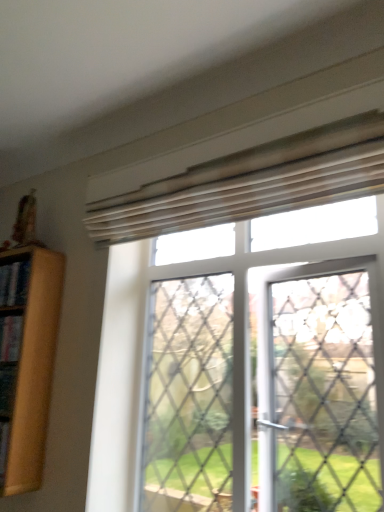
Question: Is wooden bookshelf at left thinner than translucent wood blinds at upper center?

Choices:
 (A) no
 (B) yes

Answer: (B)

Question: Could you tell me if wooden bookshelf at left is facing translucent wood blinds at upper center?

Choices:
 (A) no
 (B) yes

Answer: (A)

Question: Does wooden bookshelf at left appear on the left side of translucent wood blinds at upper center?

Choices:
 (A) no
 (B) yes

Answer: (B)

Question: From a real-world perspective, does wooden bookshelf at left sit lower than translucent wood blinds at upper center?

Choices:
 (A) no
 (B) yes

Answer: (B)

Question: From a real-world perspective, is wooden bookshelf at left over translucent wood blinds at upper center?

Choices:
 (A) no
 (B) yes

Answer: (A)

Question: Is wooden bookshelf at left placed right next to translucent wood blinds at upper center?

Choices:
 (A) yes
 (B) no

Answer: (B)

Question: Would you say translucent wood blinds at upper center contains wooden bookshelf at left?

Choices:
 (A) no
 (B) yes

Answer: (A)

Question: Can you confirm if translucent wood blinds at upper center is wider than wooden bookshelf at left?

Choices:
 (A) no
 (B) yes

Answer: (B)

Question: Is translucent wood blinds at upper center thinner than wooden bookshelf at left?

Choices:
 (A) no
 (B) yes

Answer: (A)

Question: Can you confirm if translucent wood blinds at upper center is positioned to the right of wooden bookshelf at left?

Choices:
 (A) yes
 (B) no

Answer: (A)

Question: Is translucent wood blinds at upper center at the left side of wooden bookshelf at left?

Choices:
 (A) no
 (B) yes

Answer: (A)

Question: Considering the relative positions of translucent wood blinds at upper center and wooden bookshelf at left in the image provided, is translucent wood blinds at upper center in front of wooden bookshelf at left?

Choices:
 (A) no
 (B) yes

Answer: (B)

Question: In terms of height, does wooden bookshelf at left look taller or shorter compared to translucent wood blinds at upper center?

Choices:
 (A) tall
 (B) short

Answer: (B)